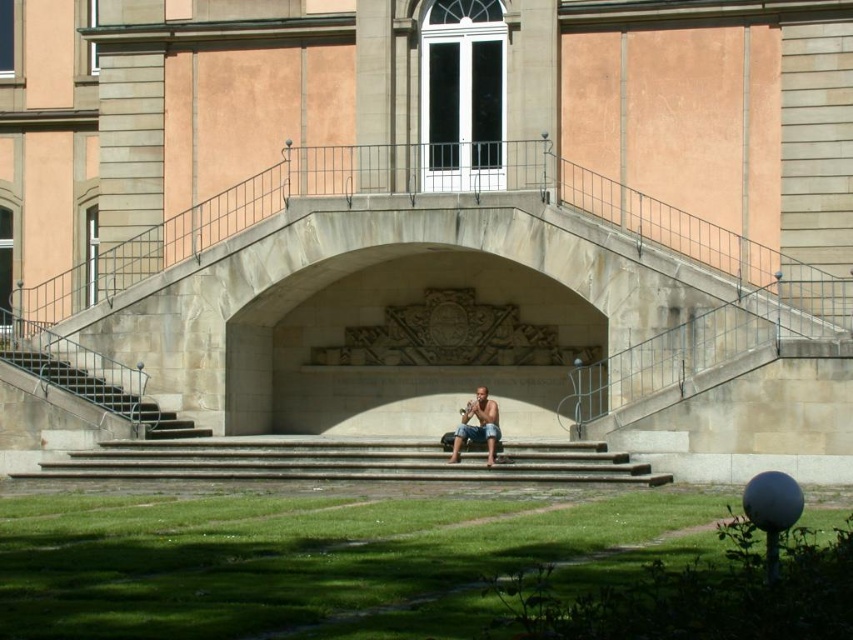
Question: Is smooth stone stairs at lower left closer to the viewer compared to tan skin person at center?

Choices:
 (A) no
 (B) yes

Answer: (A)

Question: Does smooth stone stairs at lower left have a smaller size compared to tan skin person at center?

Choices:
 (A) no
 (B) yes

Answer: (A)

Question: Among these points, which one is nearest to the camera?

Choices:
 (A) (0, 355)
 (B) (469, 419)
 (C) (318, 476)

Answer: (C)

Question: Which point appears farthest from the camera in this image?

Choices:
 (A) (494, 461)
 (B) (41, 364)
 (C) (82, 452)

Answer: (B)

Question: Which of these objects is positioned farthest from the tan skin person at center?

Choices:
 (A) smooth stone stairs at lower left
 (B) concrete stairs at center

Answer: (A)

Question: Can you confirm if smooth stone stairs at lower left is positioned to the right of tan skin person at center?

Choices:
 (A) no
 (B) yes

Answer: (A)